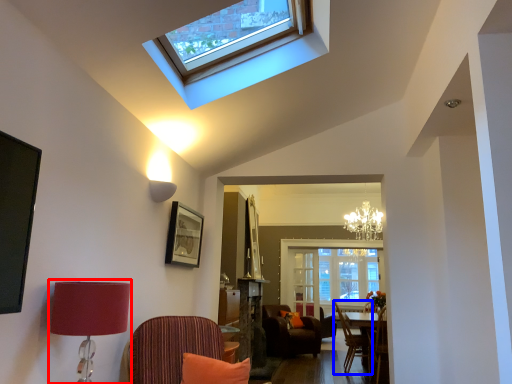
Question: Among these objects, which one is nearest to the camera, table lamp (highlighted by a red box) or chair (highlighted by a blue box)?

Choices:
 (A) table lamp
 (B) chair

Answer: (A)